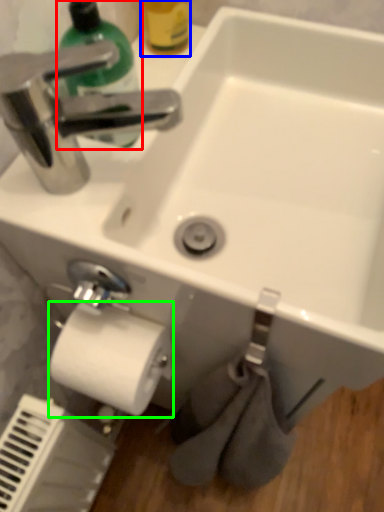
Question: Based on their relative distances, which object is farther from cleaning product (highlighted by a red box)? Choose from bottle (highlighted by a blue box) and toilet paper (highlighted by a green box).

Choices:
 (A) bottle
 (B) toilet paper

Answer: (B)